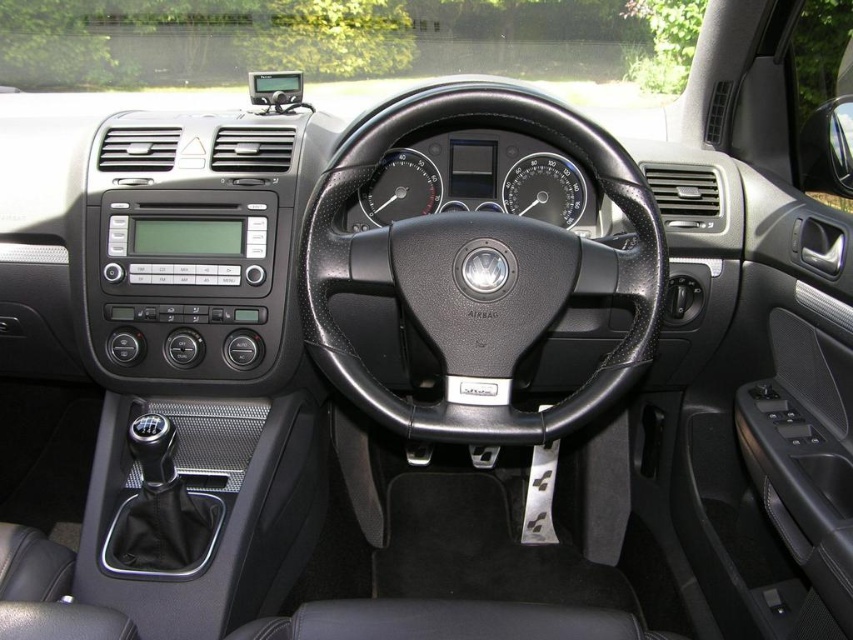
Question: Does black leather steering wheel at center appear under black plastic speedometer at center?

Choices:
 (A) yes
 (B) no

Answer: (A)

Question: Can you confirm if black leather steering wheel at center is positioned to the left of black plastic speedometer at center?

Choices:
 (A) yes
 (B) no

Answer: (A)

Question: Among these points, which one is nearest to the camera?

Choices:
 (A) (619, 285)
 (B) (570, 173)

Answer: (A)

Question: Which point appears farthest from the camera in this image?

Choices:
 (A) (418, 115)
 (B) (578, 186)
 (C) (363, 198)

Answer: (B)

Question: Can you confirm if black plastic speedometer at center is positioned to the left of black rubber gauge at center?

Choices:
 (A) yes
 (B) no

Answer: (B)

Question: Which object is the closest to the black plastic speedometer at center?

Choices:
 (A) black rubber gauge at center
 (B) black leather steering wheel at center

Answer: (A)